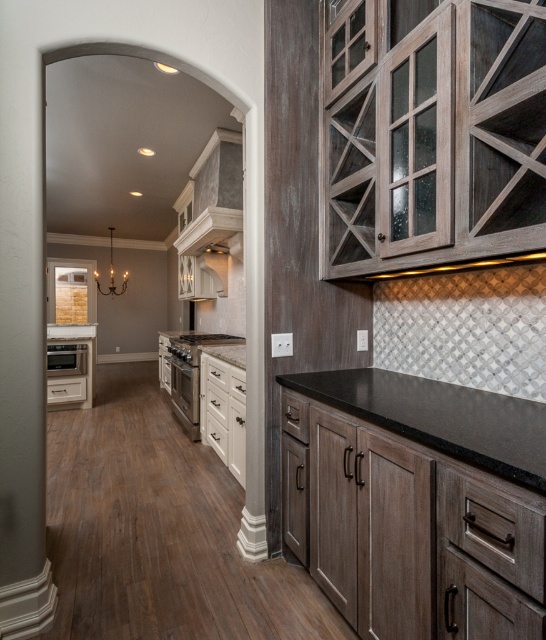
You are a delivery person standing at the entrance of the kitchen. You need to place a package that is 4 meters long on the floor. Is there enough space between you and the satin nickel oven at center to place the package?

The distance between you and the satin nickel oven at center is 4.16 meters, so there is enough space to place the 4 meter long package between you and the satin nickel oven at center.

You are a kitchen designer trying to install a new backsplash tile that requires a minimum of 1 meter width between the satin nickel oven at center and the matte glass exhaust hood at center. Based on the current setup, can you confirm if there is enough space between them?

The satin nickel oven at center is wider than the matte glass exhaust hood at center, so the distance between them may vary depending on their exact positions. However, since the backsplash tile requires a minimum of 1 meter width between them, you should measure the actual distance to ensure it meets the requirement.